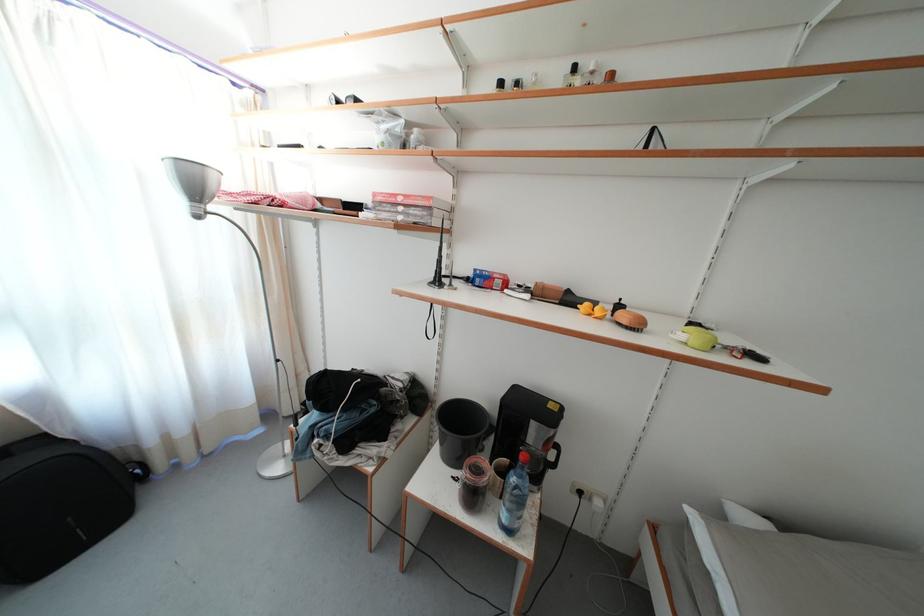
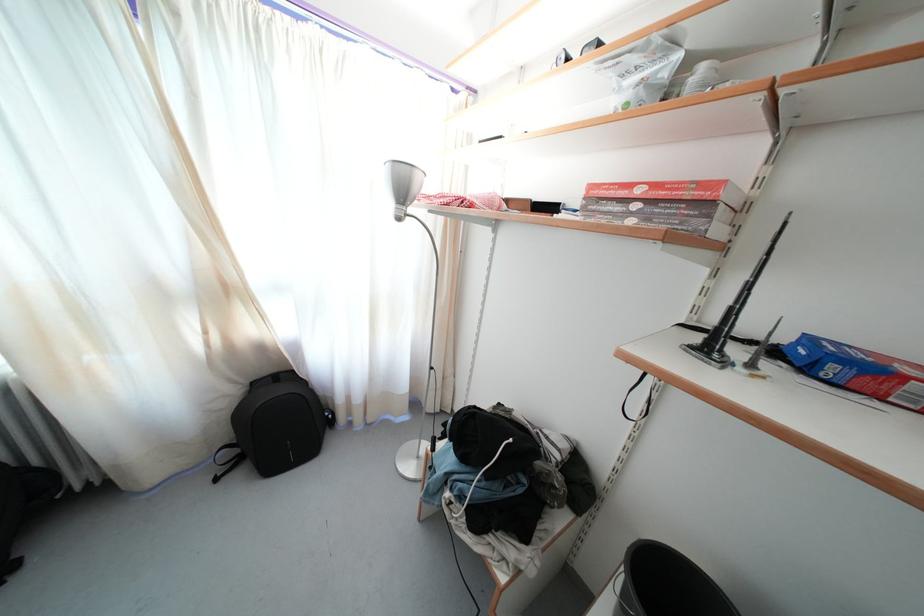
Question: Based on the continuous images, in which direction is the camera rotating? Reply with the corresponding letter.

Choices:
 (A) Left
 (B) Right
 (C) Up
 (D) Down

Answer: (A)